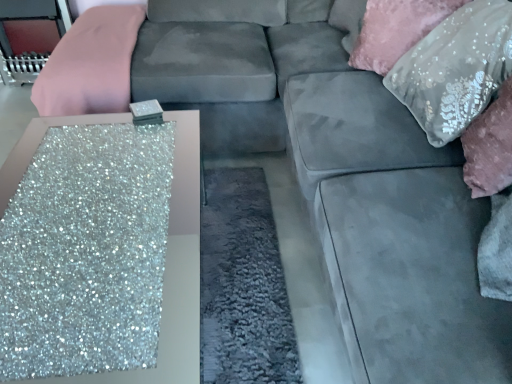
This screenshot has width=512, height=384. What do you see at coordinates (455, 69) in the screenshot?
I see `satin silver pillow at upper right, the 2th pillow when ordered from back to front` at bounding box center [455, 69].

Where is `glittery silver table at lower left`? glittery silver table at lower left is located at coordinates (176, 269).

Is glittery silver table at lower left taller or shorter than satin silver pillow at upper right, positioned as the 1th pillow in front-to-back order?

glittery silver table at lower left is shorter than satin silver pillow at upper right, positioned as the 1th pillow in front-to-back order.

Could you measure the distance between glittery silver table at lower left and satin silver pillow at upper right, the 2th pillow when ordered from back to front?

glittery silver table at lower left is 2.05 meters from satin silver pillow at upper right, the 2th pillow when ordered from back to front.

Consider the image. From the image's perspective, which is above, glittery silver table at lower left or satin silver pillow at upper right, the 2th pillow when ordered from back to front?

satin silver pillow at upper right, the 2th pillow when ordered from back to front.

Consider the image. Which of these two, glittery silver table at lower left or satin silver pillow at upper right, positioned as the 1th pillow in front-to-back order, is smaller?

satin silver pillow at upper right, positioned as the 1th pillow in front-to-back order, is smaller.

Could sequined fabric pillow at upper right, acting as the 2th pillow starting from the front, be considered to be inside satin silver pillow at upper right, the 2th pillow when ordered from back to front?

Yes, satin silver pillow at upper right, the 2th pillow when ordered from back to front, is surrounding sequined fabric pillow at upper right, acting as the 2th pillow starting from the front.

Who is shorter, satin silver pillow at upper right, the 2th pillow when ordered from back to front, or sequined fabric pillow at upper right, acting as the 2th pillow starting from the front?

sequined fabric pillow at upper right, acting as the 2th pillow starting from the front, is shorter.

From a real-world perspective, relative to sequined fabric pillow at upper right, acting as the 2th pillow starting from the front, is satin silver pillow at upper right, positioned as the 1th pillow in front-to-back order, vertically above or below?

From a real-world perspective, satin silver pillow at upper right, positioned as the 1th pillow in front-to-back order, is physically above sequined fabric pillow at upper right, acting as the 2th pillow starting from the front.

The image size is (512, 384). I want to click on pillow lying above the satin silver pillow at upper right, the 2th pillow when ordered from back to front (from the image's perspective), so click(x=396, y=30).

From the image's perspective, between glittery silver table at lower left and sequined fabric pillow at upper right, acting as the 2th pillow starting from the front, which one is located above?

sequined fabric pillow at upper right, acting as the 2th pillow starting from the front, appears higher in the image.

Looking at this image, is sequined fabric pillow at upper right, arranged as the 1th pillow when viewed from the back, at the back of glittery silver table at lower left?

No, glittery silver table at lower left's orientation is not away from sequined fabric pillow at upper right, arranged as the 1th pillow when viewed from the back.

From a real-world perspective, between glittery silver table at lower left and sequined fabric pillow at upper right, acting as the 2th pillow starting from the front, who is vertically lower?

glittery silver table at lower left, from a real-world perspective.

Can you confirm if glittery silver table at lower left is taller than sequined fabric pillow at upper right, arranged as the 1th pillow when viewed from the back?

Yes.

Is sequined fabric pillow at upper right, acting as the 2th pillow starting from the front, looking in the opposite direction of glittery silver table at lower left?

That's not correct — sequined fabric pillow at upper right, acting as the 2th pillow starting from the front, is not looking away from glittery silver table at lower left.

Which is more to the left, sequined fabric pillow at upper right, acting as the 2th pillow starting from the front, or glittery silver table at lower left?

glittery silver table at lower left is more to the left.

Can you tell me how much sequined fabric pillow at upper right, arranged as the 1th pillow when viewed from the back, and glittery silver table at lower left differ in facing direction?

The angle between the facing direction of sequined fabric pillow at upper right, arranged as the 1th pillow when viewed from the back, and the facing direction of glittery silver table at lower left is 46.7 degrees.

Is sequined fabric pillow at upper right, acting as the 2th pillow starting from the front, situated inside glittery silver table at lower left or outside?

sequined fabric pillow at upper right, acting as the 2th pillow starting from the front, is spatially situated outside glittery silver table at lower left.

Is point (497, 31) positioned behind point (5, 189)?

No.

What's the angular difference between satin silver pillow at upper right, the 2th pillow when ordered from back to front, and glittery silver table at lower left's facing directions?

satin silver pillow at upper right, the 2th pillow when ordered from back to front, and glittery silver table at lower left are facing 1.51 degrees away from each other.

In the scene shown: From a real-world perspective, who is located higher, satin silver pillow at upper right, positioned as the 1th pillow in front-to-back order, or glittery silver table at lower left?

From a 3D spatial view, satin silver pillow at upper right, positioned as the 1th pillow in front-to-back order, is above.

Is satin silver pillow at upper right, positioned as the 1th pillow in front-to-back order, wider or thinner than glittery silver table at lower left?

In the image, satin silver pillow at upper right, positioned as the 1th pillow in front-to-back order, appears to be more narrow than glittery silver table at lower left.

Does sequined fabric pillow at upper right, acting as the 2th pillow starting from the front, lie in front of satin silver pillow at upper right, positioned as the 1th pillow in front-to-back order?

No, sequined fabric pillow at upper right, acting as the 2th pillow starting from the front, is further to the viewer.

From a real-world perspective, does sequined fabric pillow at upper right, arranged as the 1th pillow when viewed from the back, sit lower than satin silver pillow at upper right, the 2th pillow when ordered from back to front?

Yes, from a real-world perspective, sequined fabric pillow at upper right, arranged as the 1th pillow when viewed from the back, is under satin silver pillow at upper right, the 2th pillow when ordered from back to front.

Could you tell me if sequined fabric pillow at upper right, acting as the 2th pillow starting from the front, is turned towards satin silver pillow at upper right, the 2th pillow when ordered from back to front?

Yes, sequined fabric pillow at upper right, acting as the 2th pillow starting from the front, faces towards satin silver pillow at upper right, the 2th pillow when ordered from back to front.

Locate an element on the screen. The height and width of the screenshot is (384, 512). pillow that is the 1st one when counting upward from the glittery silver table at lower left (from the image's perspective) is located at coordinates (455, 69).

Locate an element on the screen. The image size is (512, 384). pillow located in front of the sequined fabric pillow at upper right, acting as the 2th pillow starting from the front is located at coordinates pyautogui.click(x=455, y=69).

Based on the photo, which object lies nearer to the anchor point glittery silver table at lower left, satin silver pillow at upper right, the 2th pillow when ordered from back to front, or sequined fabric pillow at upper right, acting as the 2th pillow starting from the front?

The object closer to glittery silver table at lower left is sequined fabric pillow at upper right, acting as the 2th pillow starting from the front.

Estimate the real-world distances between objects in this image. Which object is closer to satin silver pillow at upper right, positioned as the 1th pillow in front-to-back order, glittery silver table at lower left or sequined fabric pillow at upper right, acting as the 2th pillow starting from the front?

sequined fabric pillow at upper right, acting as the 2th pillow starting from the front, lies closer to satin silver pillow at upper right, positioned as the 1th pillow in front-to-back order, than the other object.

Based on their spatial positions, is satin silver pillow at upper right, the 2th pillow when ordered from back to front, or glittery silver table at lower left further from sequined fabric pillow at upper right, arranged as the 1th pillow when viewed from the back?

glittery silver table at lower left.

Considering their positions, is sequined fabric pillow at upper right, arranged as the 1th pillow when viewed from the back, positioned further to glittery silver table at lower left than satin silver pillow at upper right, the 2th pillow when ordered from back to front?

Among the two, satin silver pillow at upper right, the 2th pillow when ordered from back to front, is located further to glittery silver table at lower left.

In the scene shown: From the image, which object appears to be nearer to satin silver pillow at upper right, positioned as the 1th pillow in front-to-back order, sequined fabric pillow at upper right, acting as the 2th pillow starting from the front, or glittery silver table at lower left?

sequined fabric pillow at upper right, acting as the 2th pillow starting from the front, is positioned closer to the anchor satin silver pillow at upper right, positioned as the 1th pillow in front-to-back order.

Which object lies further to the anchor point sequined fabric pillow at upper right, acting as the 2th pillow starting from the front, glittery silver table at lower left or satin silver pillow at upper right, positioned as the 1th pillow in front-to-back order?

glittery silver table at lower left.

Image resolution: width=512 pixels, height=384 pixels. In order to click on pillow between glittery silver table at lower left and satin silver pillow at upper right, positioned as the 1th pillow in front-to-back order in this screenshot , I will do `click(396, 30)`.